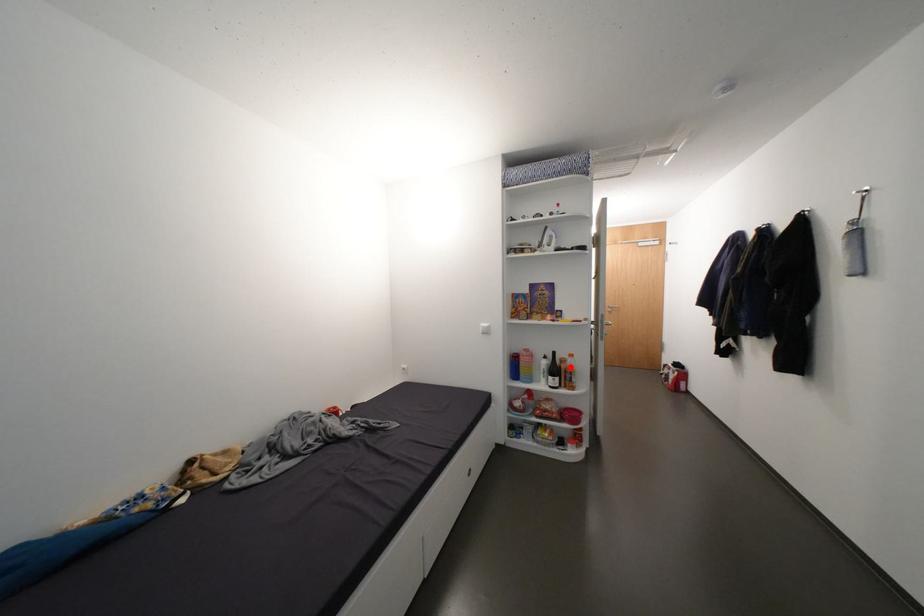
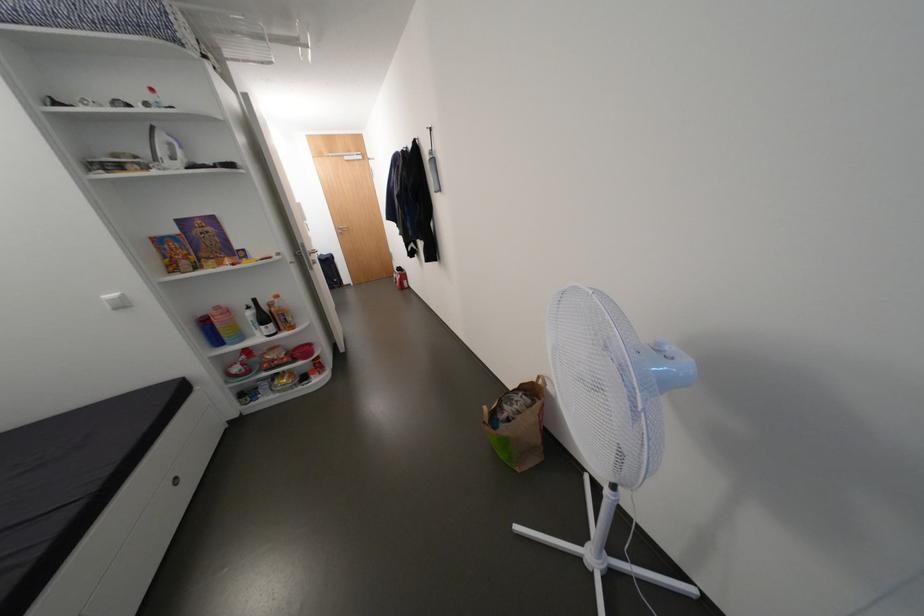
Question: I am providing you with two images of the same scene from different viewpoints. Image1 has a red point marked. In image2, the corresponding 3D location appears at what relative position? Reply with the corresponding letter.

Choices:
 (A) Closer
 (B) Farther

Answer: (A)